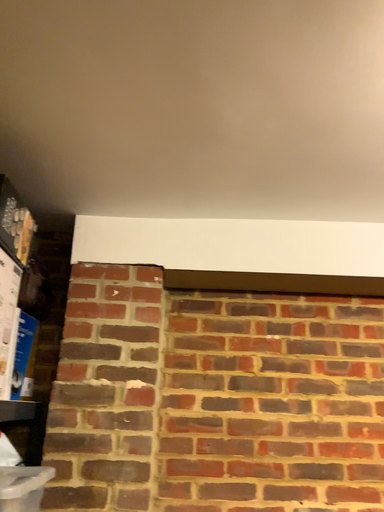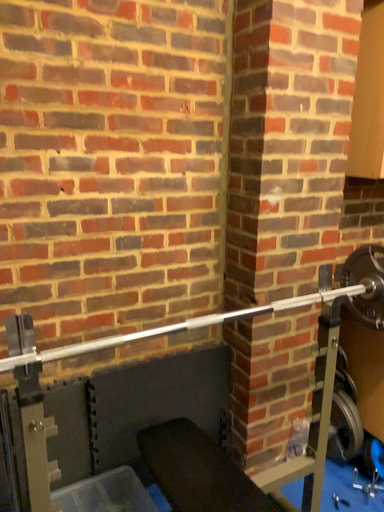
Question: How did the camera likely rotate when shooting the video?

Choices:
 (A) rotated right
 (B) rotated left

Answer: (A)